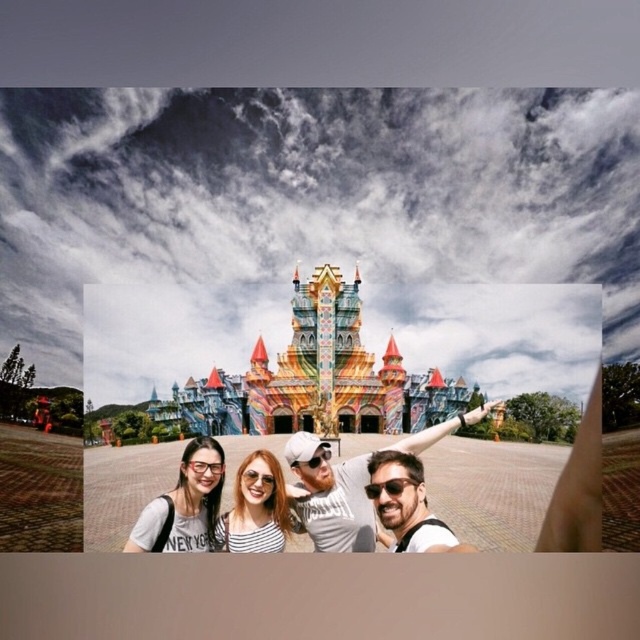
You are part of the group taking a selfie in front of the castle. You want to make sure everyone is visible in the photo. Since you have the matte black glasses at center and the matte striped shirt at center in your frame, which one is closer to the camera?

The matte striped shirt at center is behind matte black glasses at center, so the matte black glasses at center is closer to the camera.